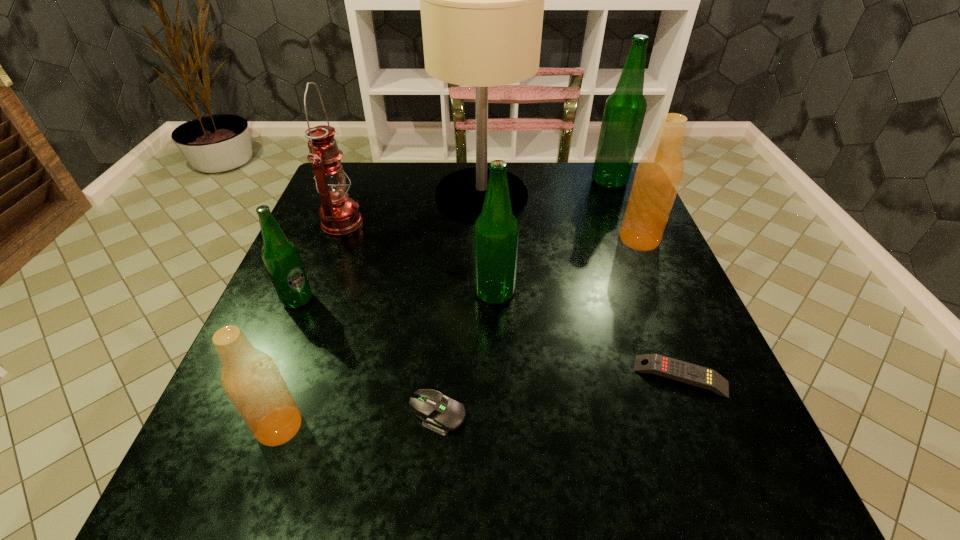
Find the location of a particular element. This screenshot has width=960, height=540. beer bottle that can be found as the fifth closest to the computer mouse is located at coordinates (624, 112).

The image size is (960, 540). I want to click on beer bottle identified as the closest to the nearest beer bottle, so click(280, 255).

This screenshot has width=960, height=540. In order to click on the closest green beer bottle to the leftmost green beer bottle in this screenshot , I will do `click(496, 231)`.

Identify which green beer bottle is the second nearest to the second smallest green beer bottle. Please provide its 2D coordinates. Your answer should be formatted as a tuple, i.e. [(x, y)], where the tuple contains the x and y coordinates of a point satisfying the conditions above.

[(624, 112)]

Locate an element on the screen. This screenshot has width=960, height=540. free region that satisfies the following two spatial constraints: 1. on the label of the smallest green beer bottle; 2. on the left side of the remote control is located at coordinates (266, 376).

Locate an element on the screen. Image resolution: width=960 pixels, height=540 pixels. free space that satisfies the following two spatial constraints: 1. on the front side of the beige table lamp; 2. on the label of the smallest green beer bottle is located at coordinates (482, 300).